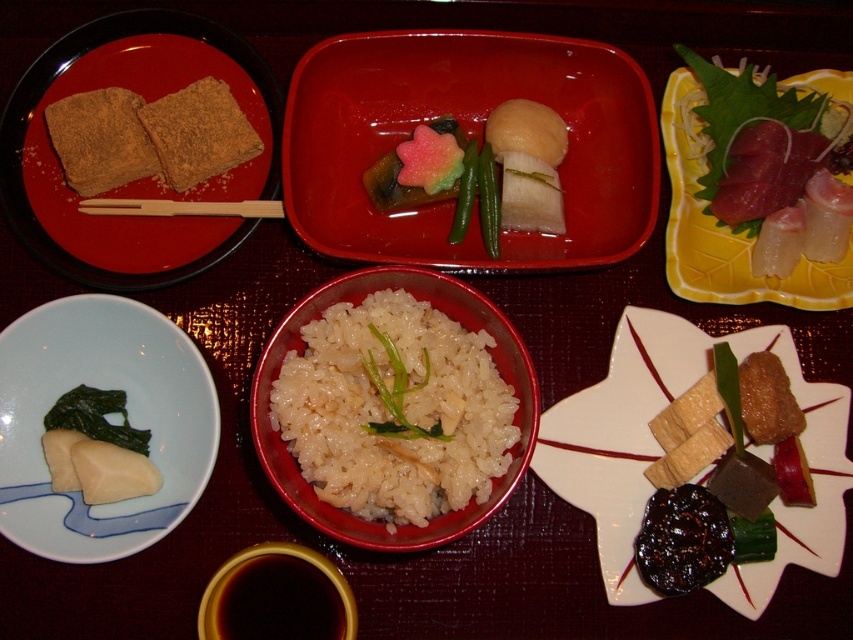
Question: Which point is farther to the camera?

Choices:
 (A) yellow leaf-shaped plate at upper right
 (B) dark brown liquid at bottom center

Answer: (A)

Question: Estimate the real-world distances between objects in this image. Which object is closer to the shiny red lacquer tray at center?

Choices:
 (A) dark brown liquid at bottom center
 (B) wooden chopsticks at upper left

Answer: (B)

Question: Which object appears closest to the camera in this image?

Choices:
 (A) shiny red lacquer tray at center
 (B) white soft tofu at lower left

Answer: (B)

Question: Considering the relative positions of white polished rice at center and dark brown liquid at bottom center in the image provided, where is white polished rice at center located with respect to dark brown liquid at bottom center?

Choices:
 (A) right
 (B) left

Answer: (A)

Question: Is white polished rice at center above shiny brown cube at lower right?

Choices:
 (A) yes
 (B) no

Answer: (A)

Question: Is white polished rice at center bigger than white matte bowl at lower left?

Choices:
 (A) no
 (B) yes

Answer: (A)